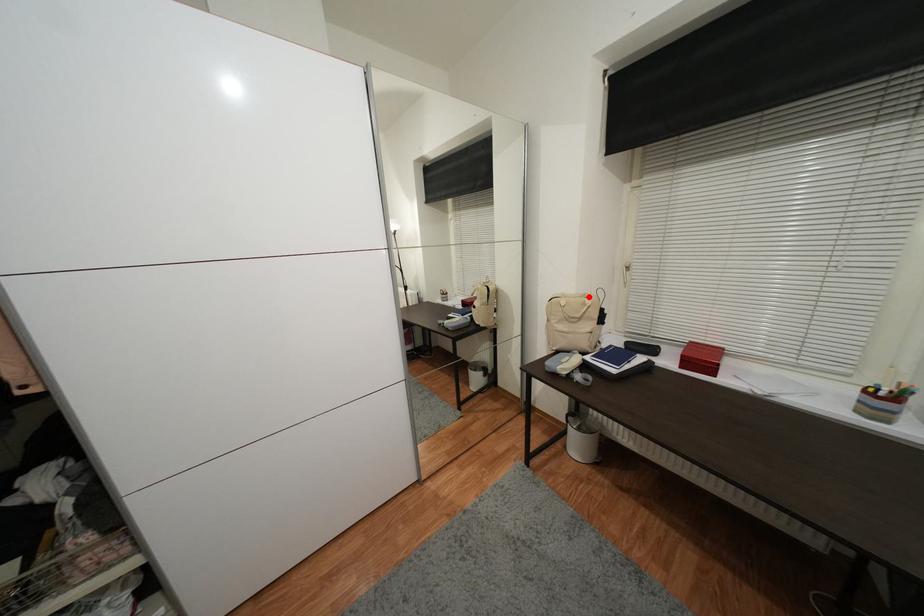
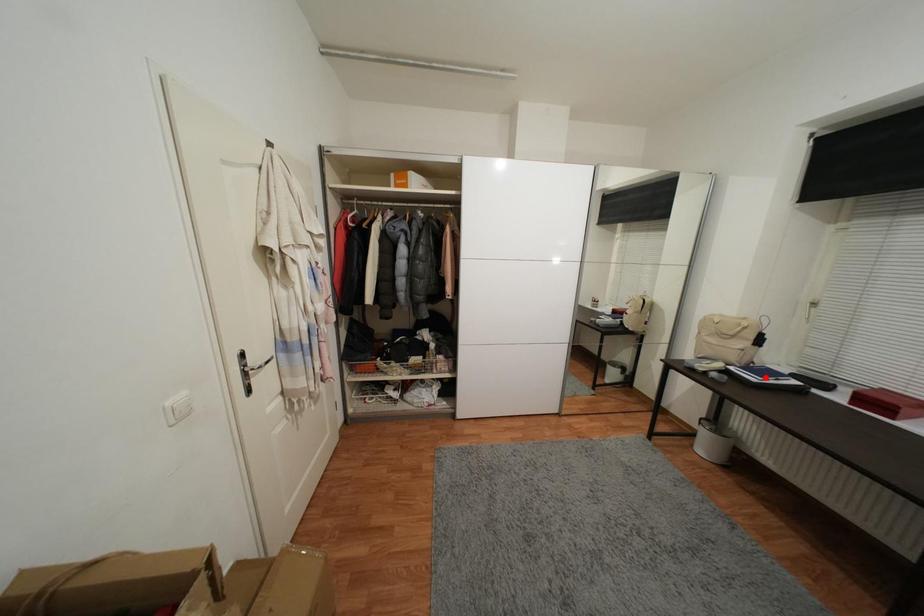
I am providing you with two images of the same scene from different viewpoints. A red point is marked on the first image and another point is marked on the second image. Is the marked point in image1 the same physical position as the marked point in image2?

No